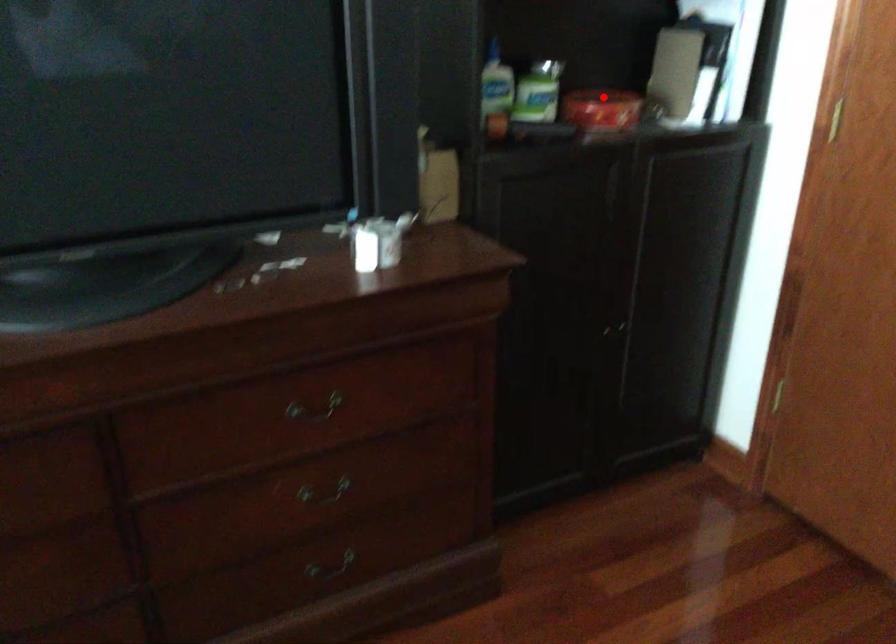
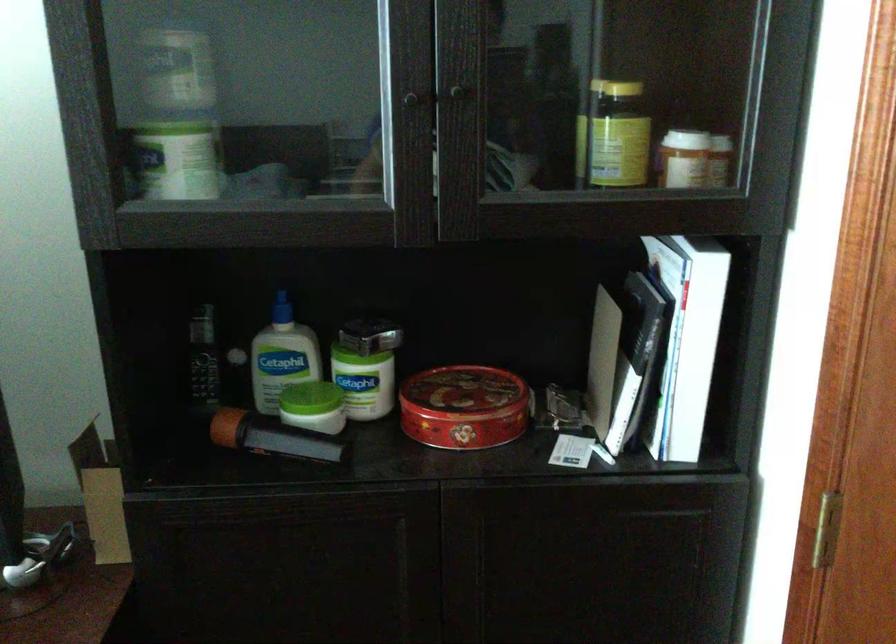
Locate, in the second image, the point that corresponds to the highlighted location in the first image.

(462, 393)